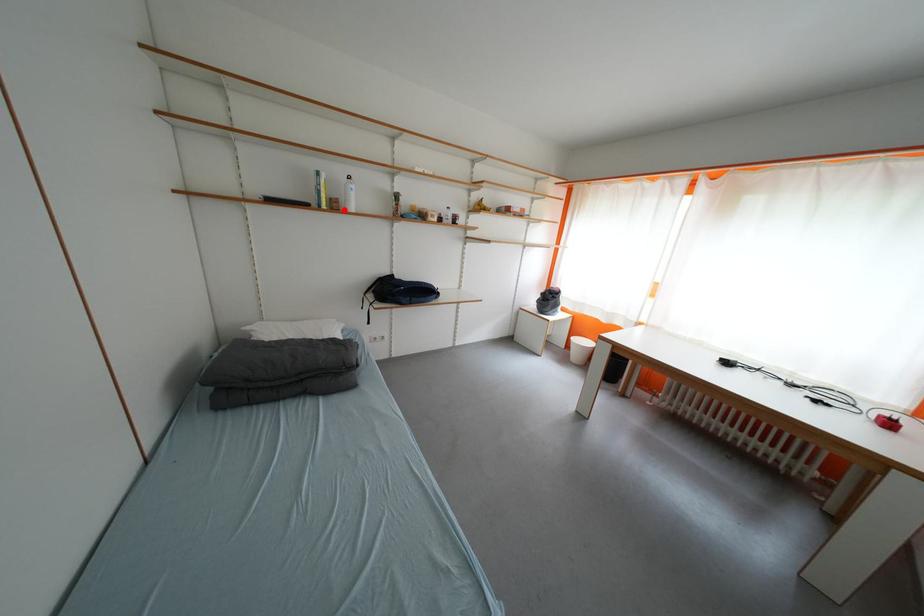
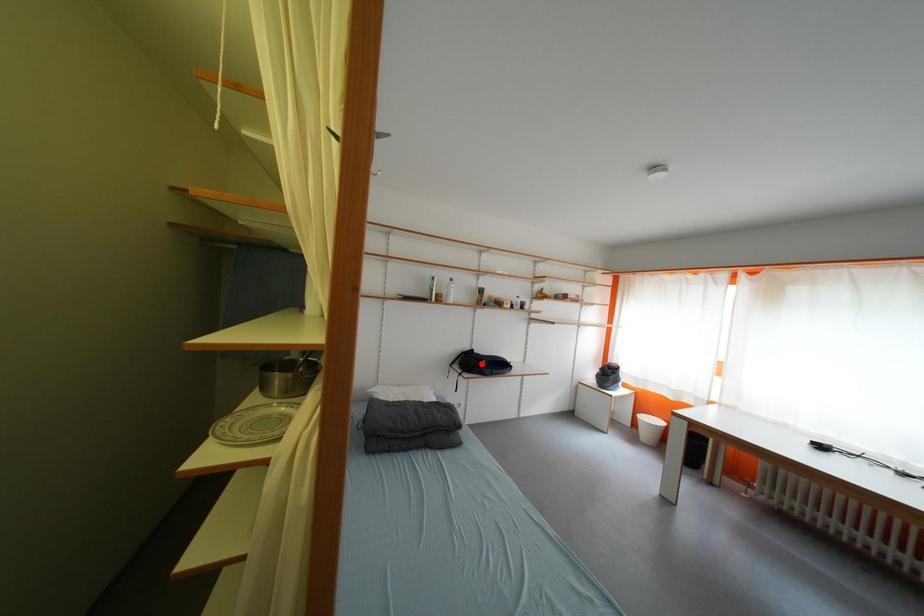
I am providing you with two images of the same scene from different viewpoints. A red point is marked on the first image and another point is marked on the second image. Does the point marked in image1 correspond to the same location as the one in image2?

No